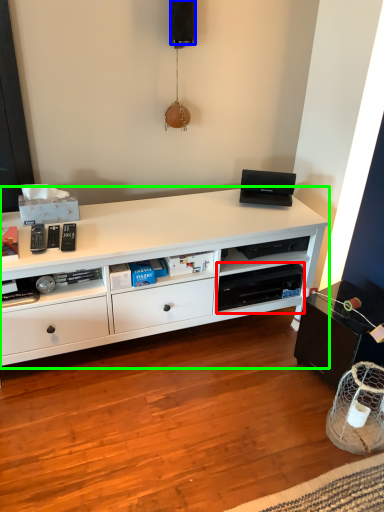
Question: Which object is positioned farthest from shelf (highlighted by a red box)? Select from speaker (highlighted by a blue box) and desk (highlighted by a green box).

Choices:
 (A) speaker
 (B) desk

Answer: (A)